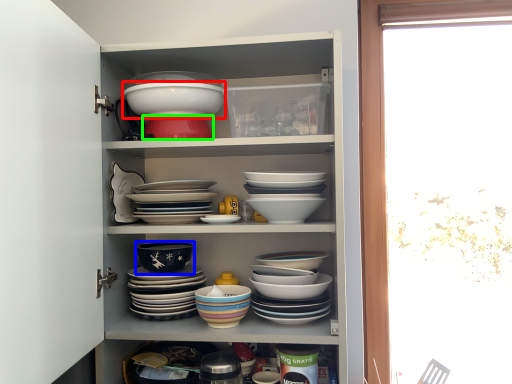
Question: Which is farther away from bowl (highlighted by a red box)? bowl (highlighted by a blue box) or bowl (highlighted by a green box)?

Choices:
 (A) bowl
 (B) bowl

Answer: (A)